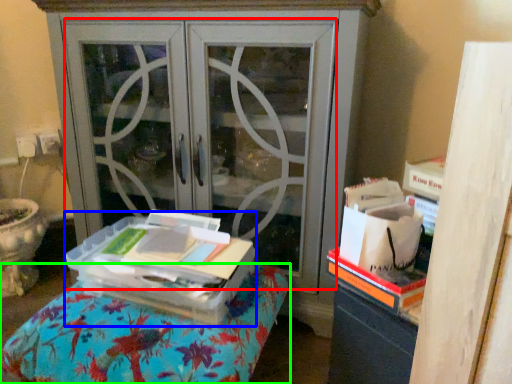
Question: Which is farther away from screen door (highlighted by a red box)? cardboard box (highlighted by a blue box) or furniture (highlighted by a green box)?

Choices:
 (A) cardboard box
 (B) furniture

Answer: (B)